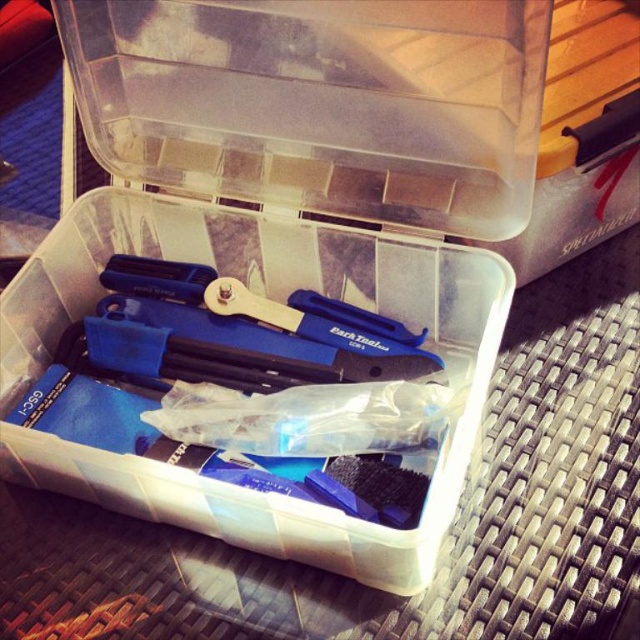
Who is lower down, transparent plastic container at center or transparent plastic tools at center?

Positioned lower is transparent plastic tools at center.

Who is positioned more to the left, transparent plastic container at center or transparent plastic tools at center?

transparent plastic tools at center

Does point (237, 129) lie in front of point (250, 211)?

Yes, it is in front of point (250, 211).

Locate an element on the screen. transparent plastic container at center is located at coordinates (353, 115).